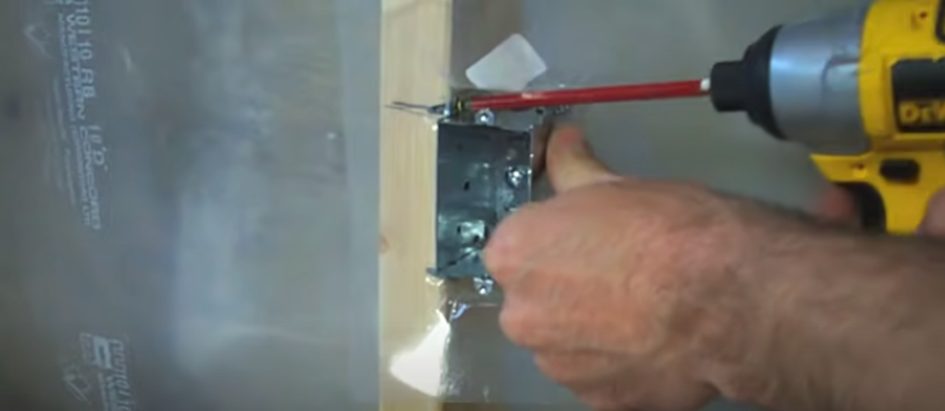
This screenshot has width=945, height=411. In order to click on empty space on drywall in this screenshot , I will do `click(254, 80)`.